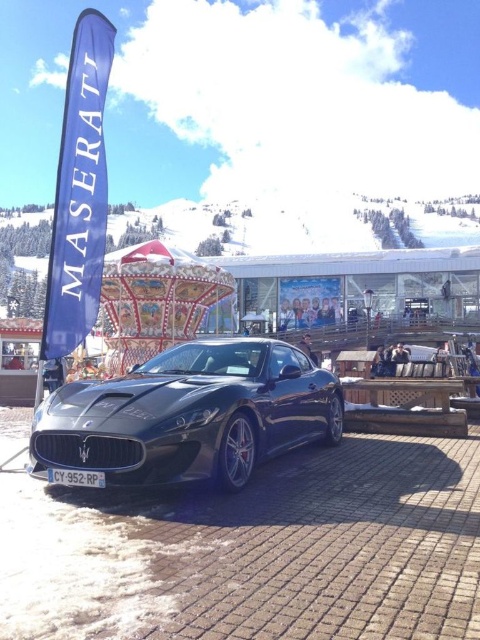
You are a photographer trying to capture the glossy black sports car at center and the wooden picnic table at center in a single shot. Can you position yourself so that both are visible without any obstruction?

The glossy black sports car at center is in front of the wooden picnic table at center, so positioning yourself behind the wooden picnic table at center would allow both to be visible without obstruction.

You are a delivery person who needs to place a large package that is 2.5 meters long between the glossy black sports car at center and the wooden picnic table at center. Is there enough space between them to fit the package?

The glossy black sports car at center is 2.42 meters from the wooden picnic table at center. Since the package is 2.5 meters long, it is slightly longer than the available space between them. Therefore, the package cannot fit between the glossy black sports car at center and the wooden picnic table at center.

You are planning to take a photo of the glossy black sports car at center and the wooden picnic table at center. Since you want both objects to appear equally prominent in the photo, which object should you move closer to, and which should you move farther away?

Since the glossy black sports car at center is larger than the wooden picnic table at center, you should move closer to the wooden picnic table at center and move farther away from the glossy black sports car at center to make them appear equally prominent in the photo.